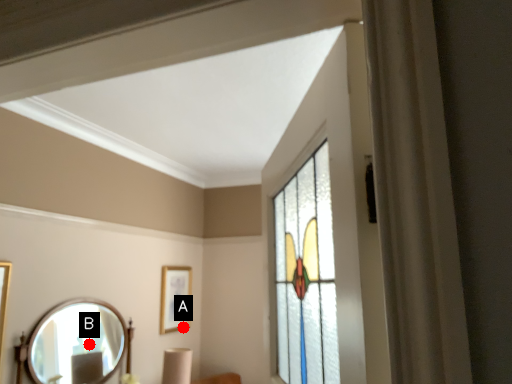
Question: Two points are circled on the image, labeled by A and B beside each circle. Which point is farther to the camera?

Choices:
 (A) A is further
 (B) B is further

Answer: (A)